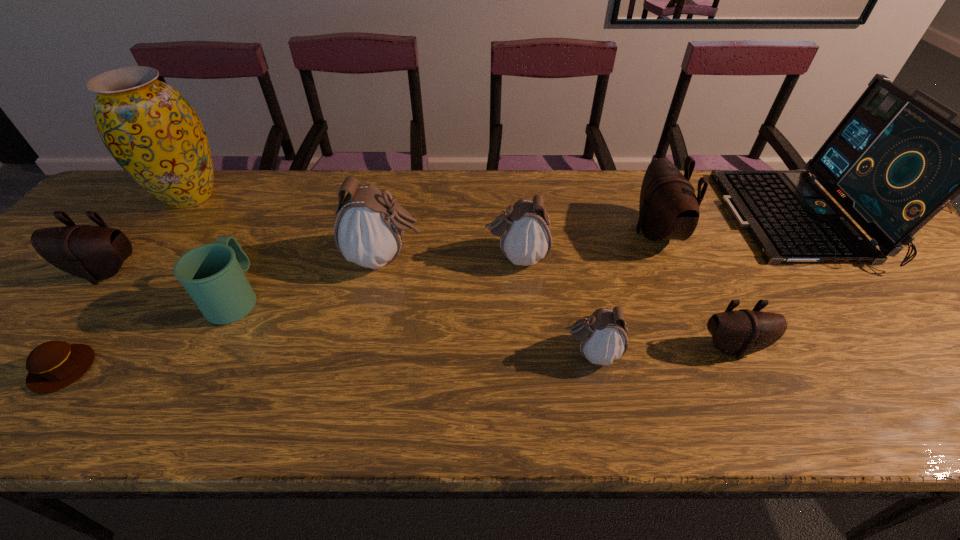
Locate an element on the screen. Image resolution: width=960 pixels, height=540 pixels. the smallest white pouch is located at coordinates (602, 336).

Where is `the smallest brown pouch`? the smallest brown pouch is located at coordinates (742, 332).

Image resolution: width=960 pixels, height=540 pixels. Find the location of `brown muffin`. brown muffin is located at coordinates (53, 365).

The image size is (960, 540). I want to click on muffin, so click(x=53, y=365).

Find the location of a particular element. This screenshot has width=960, height=540. vacant area situated 0.180m on the front of the vase is located at coordinates (137, 266).

This screenshot has height=540, width=960. What are the coordinates of `vacant space located 0.210m on the front-facing side of the rightmost object` in the screenshot? It's located at (657, 219).

I want to click on free space located on the front-facing side of the rightmost object, so click(x=620, y=219).

The width and height of the screenshot is (960, 540). What are the coordinates of `vacant area situated on the front-facing side of the rightmost object` in the screenshot? It's located at (628, 219).

Identify the location of vacant space located 0.230m on the front-facing side of the leftmost white pouch. The height and width of the screenshot is (540, 960). (516, 259).

Locate an element on the screen. The height and width of the screenshot is (540, 960). free region located with the flap open on the biggest brown pouch is located at coordinates (571, 232).